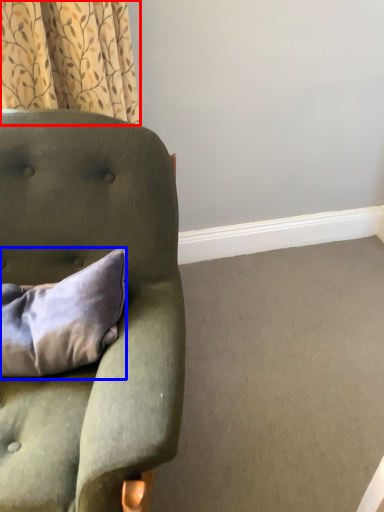
Question: Which of the following is the farthest to the observer, curtain (highlighted by a red box) or pillow (highlighted by a blue box)?

Choices:
 (A) curtain
 (B) pillow

Answer: (A)